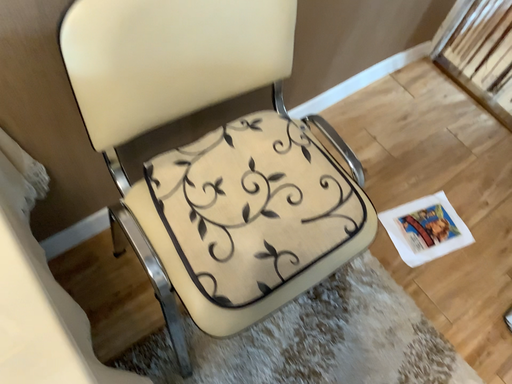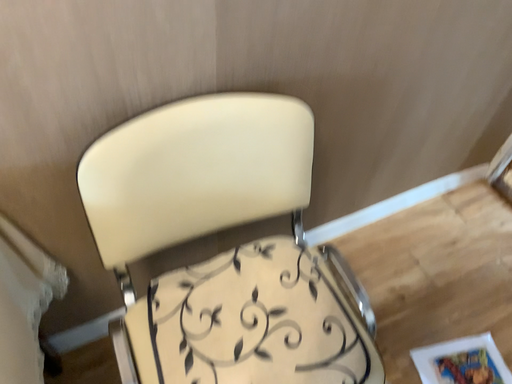
Question: Which way did the camera rotate in the video?

Choices:
 (A) rotated left
 (B) rotated right

Answer: (A)